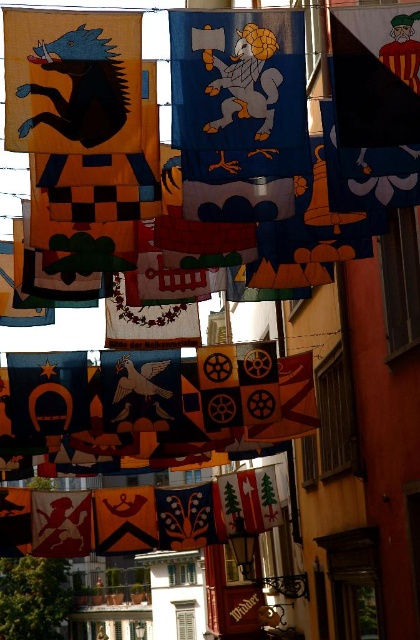
You are standing at the bottom of the image and want to place a new banner exactly where the blue matte horseshoe at center is located. According to the coordinates provided, in which direction should you move from your current position to reach that spot?

The blue matte horseshoe at center is located at coordinates point (47,392). Since you are at the bottom of the image, moving upwards would bring you closer to the center area where the horseshoe is positioned.

You are a window cleaner standing on a ladder in the middle of the street. You see the silky blue fabric at center and the silky red cloth at lower left. Which banner should you clean first if you want to start from the higher one?

The silky blue fabric at center is located above the silky red cloth at lower left, so you should clean the silky blue fabric at center first.